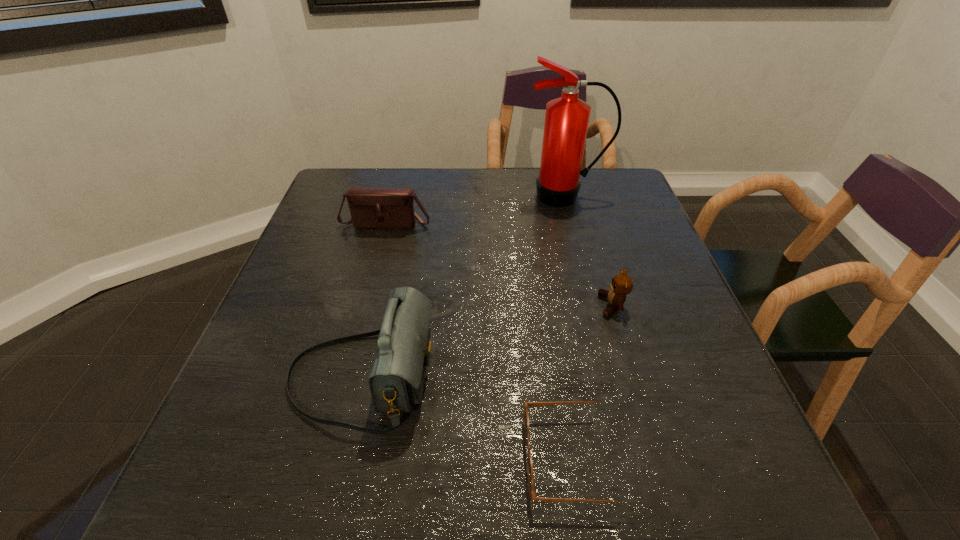
Find the location of a particular element. The width and height of the screenshot is (960, 540). fire extinguisher is located at coordinates [566, 123].

You are a GUI agent. You are given a task and a screenshot of the screen. Output one action in this format:
    pyautogui.click(x=<x>, y=<y>)
    Task: Click on the farthest object
    This screenshot has width=960, height=540.
    Given the screenshot: What is the action you would take?
    pyautogui.click(x=566, y=123)

Find the location of a particular element. the second tallest object is located at coordinates (396, 381).

Identify the location of the nearer shoulder bag. (396, 381).

At what (x,y) coordinates should I click in order to perform the action: click on the third tallest object. Please return your answer as a coordinate pair (x, y). Looking at the image, I should click on (370, 207).

I want to click on the shorter shoulder bag, so click(370, 207).

Locate an element on the screen. the third farthest object is located at coordinates (621, 285).

Where is `teddy bear`? The width and height of the screenshot is (960, 540). teddy bear is located at coordinates (621, 285).

This screenshot has width=960, height=540. What are the coordinates of `sunglasses` in the screenshot? It's located at (531, 482).

Find the location of a particular element. The image size is (960, 540). vacant area located 0.290m at the spray nozzle of the fire extinguisher is located at coordinates (587, 279).